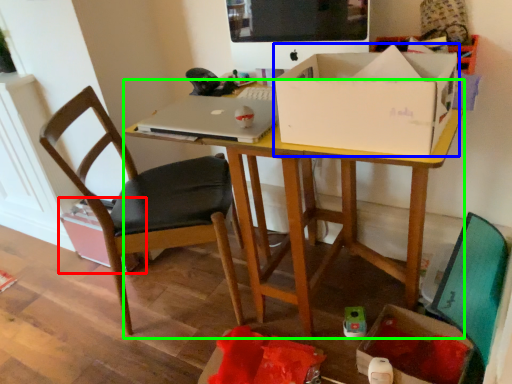
Question: Based on their relative distances, which object is farther from cardboard box (highlighted by a red box)? Choose from box (highlighted by a blue box) and desk (highlighted by a green box).

Choices:
 (A) box
 (B) desk

Answer: (A)